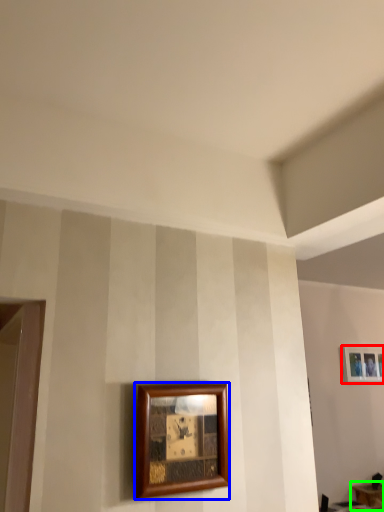
Question: Which object is the closest to the picture frame (highlighted by a red box)? Choose among these: picture frame (highlighted by a blue box) or table (highlighted by a green box).

Choices:
 (A) picture frame
 (B) table

Answer: (B)